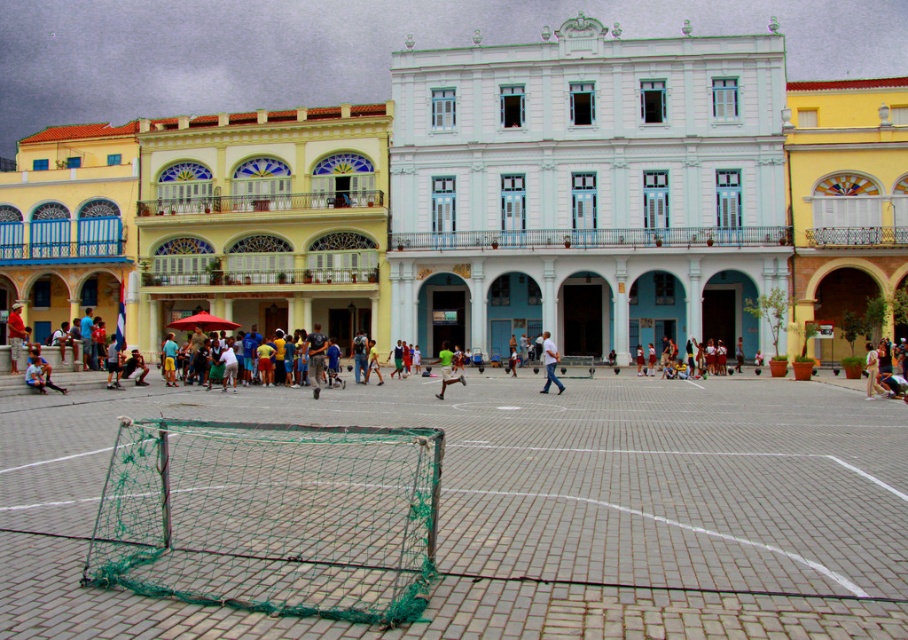
You are a photographer positioned at the edge of the square, aiming to capture a shot of both the white matte pants at center and the green jersey at center. To ensure both subjects are in frame, should you adjust your camera to focus more to the left or the right?

The white matte pants at center are to the right of the green jersey at center, so to include both in the frame, you should adjust your camera to focus more to the left to capture the green jersey at center and then pan slightly to the right to include the white matte pants at center.